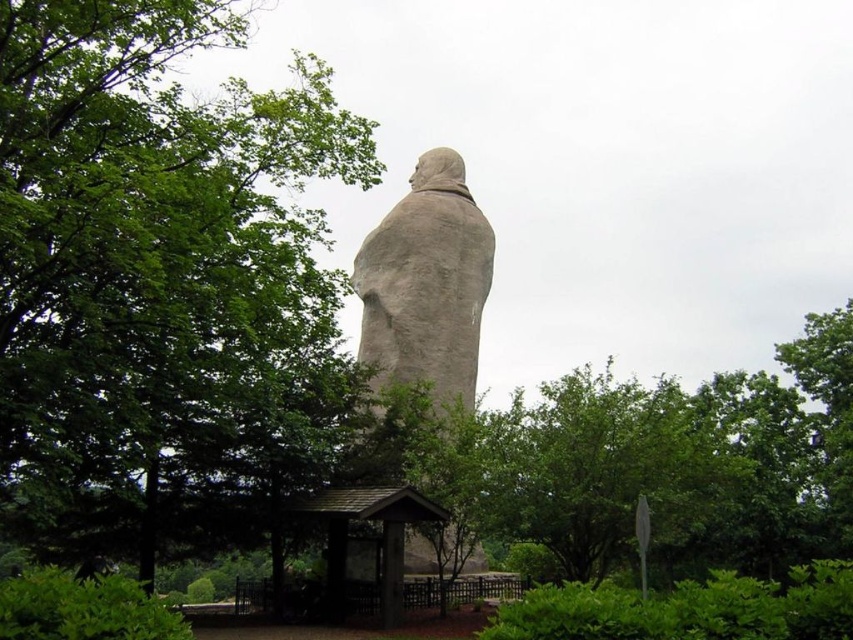
You are standing at the center of the image. Which direction should you move to avoid the gray stone statue at center?

Since the gray stone statue at center is located at point coordinates of approximately 0.447 on the x axis and 0.501 on the y axis, which is very close to the center, you should move slightly to the left or right to avoid it.

You are a photographer wanting to capture the gray stone statue at center against the backdrop of the green leafy tree at left. Since the tree is taller than the statue, will you need to adjust your camera angle to ensure the entire statue is visible in the frame?

The green leafy tree at left is taller than the gray stone statue at center, so you will need to position your camera lower to ensure the entire statue is visible without the tree blocking the top of the statue.

You are standing in front of the gray stone statue at center and want to take a photo of the green leafy tree at left. Since the tree is blocking your view, can you move to the right side of the statue to capture it?

The green leafy tree at left is above the gray stone statue at center, so moving to the right side of the statue might still allow you to see and photograph the tree as it is positioned higher than the statue.